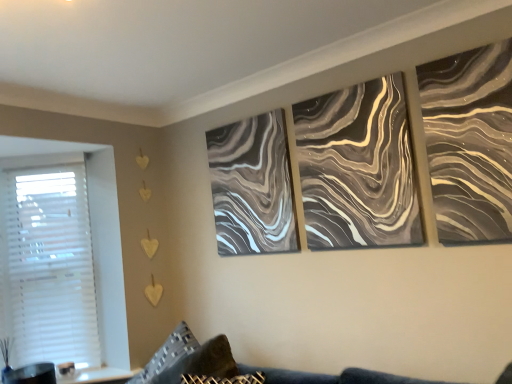
Question: Is marble-like gray painting at center, marked as the 2th canvas in a front-to-back arrangement, to the right of velvet dark blue couch at lower center from the viewer's perspective?

Choices:
 (A) yes
 (B) no

Answer: (B)

Question: Is marble-like gray painting at center, marked as the 2th canvas in a right-to-left arrangement, further to the viewer compared to velvet dark blue couch at lower center?

Choices:
 (A) no
 (B) yes

Answer: (B)

Question: Is marble-like gray painting at center, marked as the 2th canvas in a right-to-left arrangement, positioned beyond the bounds of velvet dark blue couch at lower center?

Choices:
 (A) yes
 (B) no

Answer: (A)

Question: From a real-world perspective, is marble-like gray painting at center, marked as the 2th canvas in a front-to-back arrangement, physically above velvet dark blue couch at lower center?

Choices:
 (A) no
 (B) yes

Answer: (B)

Question: Is marble-like gray painting at center, marked as the 2th canvas in a right-to-left arrangement, thinner than velvet dark blue couch at lower center?

Choices:
 (A) no
 (B) yes

Answer: (B)

Question: Is marble-like gray painting at center, marked as the 2th canvas in a front-to-back arrangement, not close to velvet dark blue couch at lower center?

Choices:
 (A) yes
 (B) no

Answer: (B)

Question: Does white plastic blinds at left appear on the left side of textured gray pillow at lower left?

Choices:
 (A) yes
 (B) no

Answer: (A)

Question: Is white plastic blinds at left completely or partially outside of textured gray pillow at lower left?

Choices:
 (A) no
 (B) yes

Answer: (B)

Question: Is white plastic blinds at left oriented towards textured gray pillow at lower left?

Choices:
 (A) no
 (B) yes

Answer: (A)

Question: Is the depth of white plastic blinds at left greater than that of textured gray pillow at lower left?

Choices:
 (A) yes
 (B) no

Answer: (A)

Question: Considering the relative positions of white plastic blinds at left and textured gray pillow at lower left in the image provided, is white plastic blinds at left in front of textured gray pillow at lower left?

Choices:
 (A) yes
 (B) no

Answer: (B)

Question: Considering the relative positions of white plastic blinds at left and textured gray pillow at lower left in the image provided, is white plastic blinds at left to the right of textured gray pillow at lower left from the viewer's perspective?

Choices:
 (A) yes
 (B) no

Answer: (B)

Question: Does white plastic blinds at left appear on the right side of metallic silver abstract art at upper right?

Choices:
 (A) no
 (B) yes

Answer: (A)